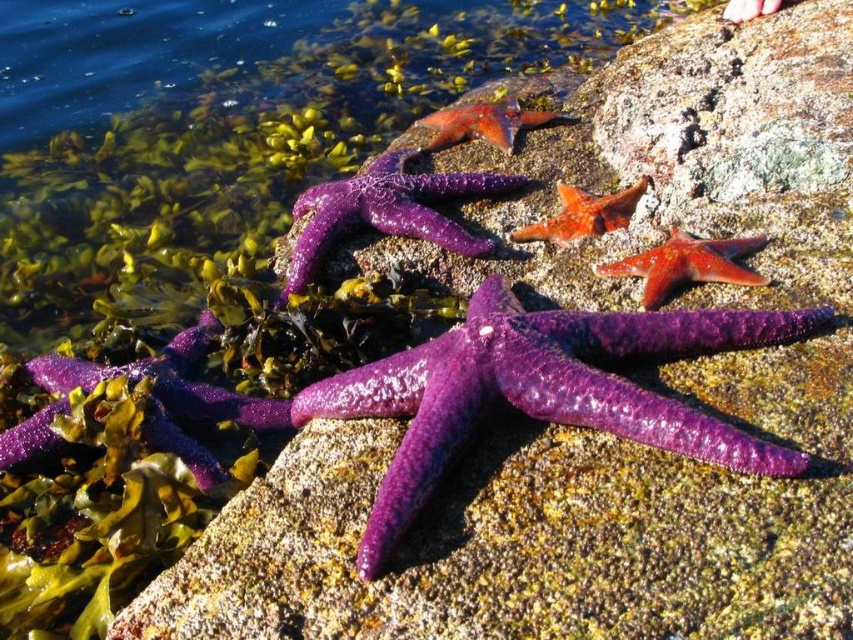
Question: Observing the image, what is the correct spatial positioning of purple shiny starfish at center in reference to shiny orange starfish at upper center?

Choices:
 (A) above
 (B) below

Answer: (B)

Question: Which of these objects is positioned farthest from the purple glossy starfish at center?

Choices:
 (A) purple shiny starfish at center
 (B) shiny orange starfish at upper center
 (C) purple shiny starfish at lower left
 (D) smooth red starfish at center

Answer: (A)

Question: Is purple shiny starfish at center in front of smooth red starfish at center?

Choices:
 (A) yes
 (B) no

Answer: (A)

Question: Which object appears closest to the camera in this image?

Choices:
 (A) purple glossy starfish at center
 (B) purple shiny starfish at center
 (C) smooth red starfish at center
 (D) purple shiny starfish at lower left

Answer: (B)

Question: Which of the following is the farthest from the observer?

Choices:
 (A) (444, 228)
 (B) (607, 225)

Answer: (A)

Question: Is purple glossy starfish at center thinner than shiny orange starfish at center?

Choices:
 (A) yes
 (B) no

Answer: (B)